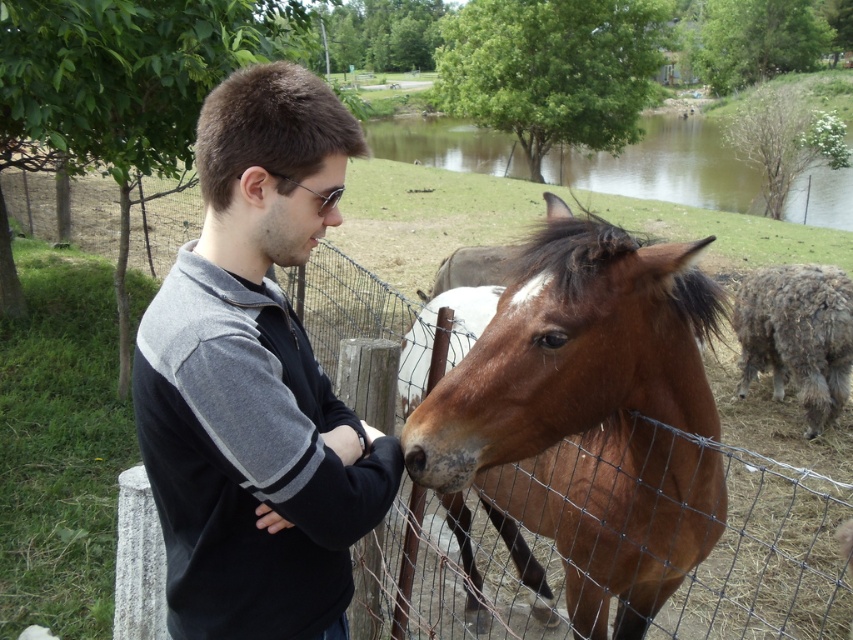
Question: Where is black fleece jacket at center located in relation to fuzzy gray sheep at right in the image?

Choices:
 (A) below
 (B) above

Answer: (A)

Question: Can you confirm if black fleece jacket at center is positioned below brown glossy horse at center?

Choices:
 (A) no
 (B) yes

Answer: (A)

Question: Can you confirm if black fleece jacket at center is bigger than fuzzy gray sheep at right?

Choices:
 (A) yes
 (B) no

Answer: (B)

Question: Which point is closer to the camera taking this photo?

Choices:
 (A) (325, 179)
 (B) (805, 316)
 (C) (519, 314)

Answer: (A)

Question: Estimate the real-world distances between objects in this image. Which object is farther from the fuzzy gray sheep at right?

Choices:
 (A) black fleece jacket at center
 (B) brown glossy horse at center

Answer: (A)

Question: Considering the real-world distances, which object is closest to the black fleece jacket at center?

Choices:
 (A) brown glossy horse at center
 (B) fuzzy gray sheep at right

Answer: (A)